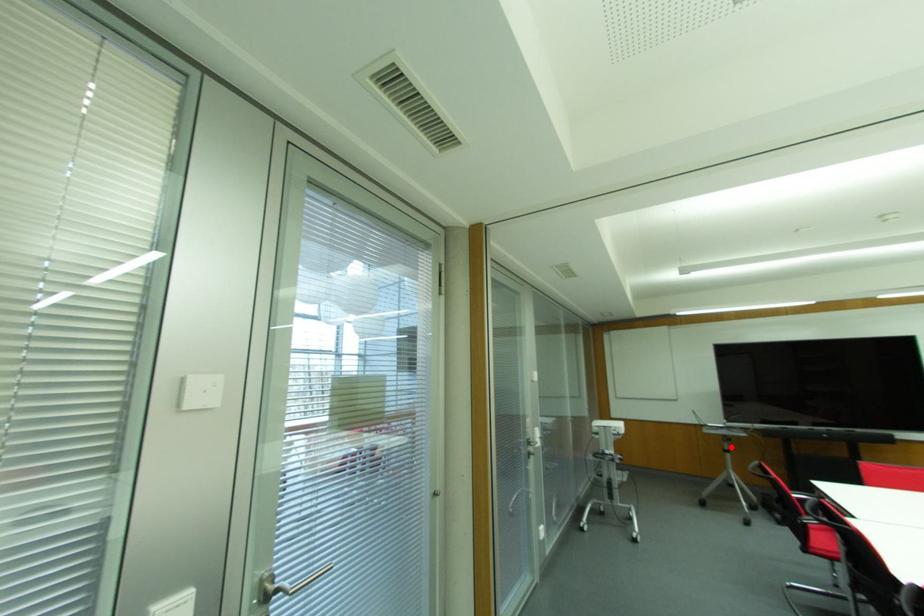
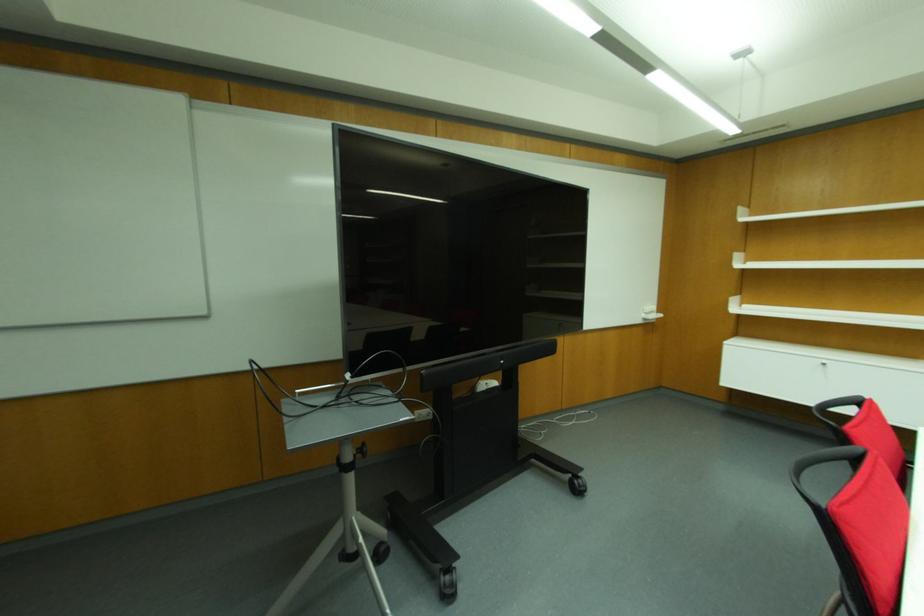
Locate, in the second image, the point that corresponds to the highlighted location in the first image.

(360, 450)